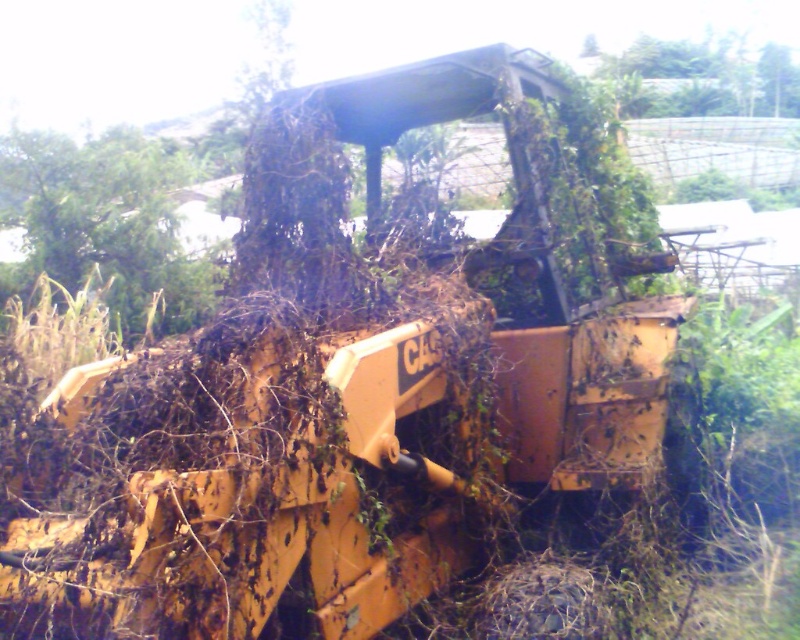
Question: Is green leafy tree at upper left smaller than green leafy tree at upper center?

Choices:
 (A) yes
 (B) no

Answer: (A)

Question: Is green leafy tree at upper left bigger than green leafy tree at upper center?

Choices:
 (A) yes
 (B) no

Answer: (B)

Question: Can you confirm if green leafy tree at upper left is bigger than green leafy tree at upper center?

Choices:
 (A) no
 (B) yes

Answer: (A)

Question: Which object is farther from the camera taking this photo?

Choices:
 (A) green leafy tree at upper left
 (B) green leafy tree at upper center

Answer: (B)

Question: Which point is closer to the camera?

Choices:
 (A) (112, 268)
 (B) (758, 100)

Answer: (A)